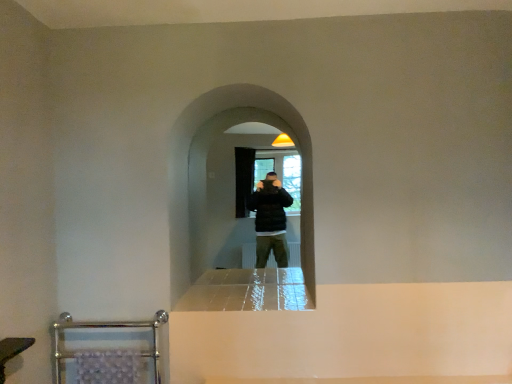
Question: Considering the positions of brushed metal towel rack at lower left and black matte screen door at center in the image, is brushed metal towel rack at lower left bigger or smaller than black matte screen door at center?

Choices:
 (A) small
 (B) big

Answer: (A)

Question: Is point (32, 339) positioned closer to the camera than point (175, 196)?

Choices:
 (A) closer
 (B) farther

Answer: (A)

Question: Which object is the closest to the chrome metallic towel rack at lower left?

Choices:
 (A) brushed metal towel rack at lower left
 (B) black matte screen door at center

Answer: (A)

Question: Estimate the real-world distances between objects in this image. Which object is closer to the brushed metal towel rack at lower left?

Choices:
 (A) chrome metallic towel rack at lower left
 (B) black matte screen door at center

Answer: (A)